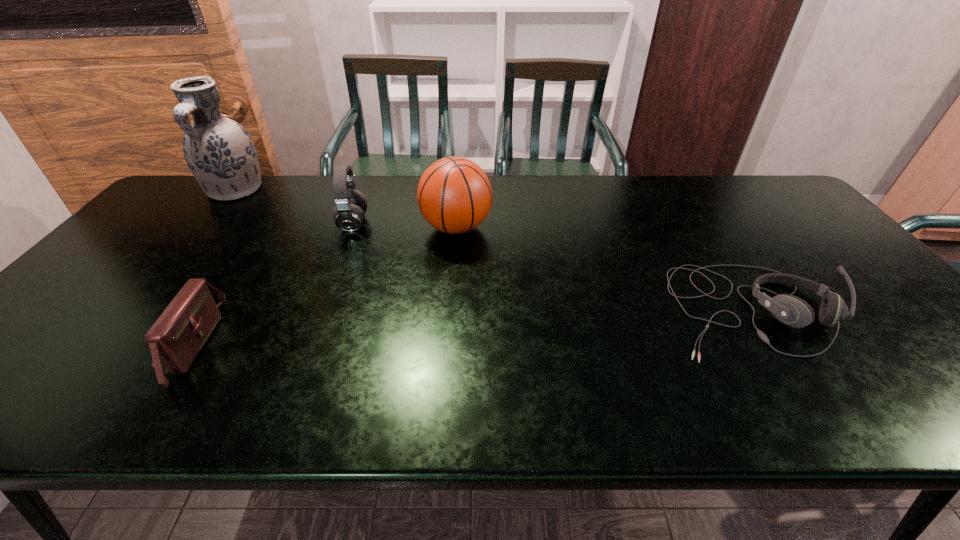
This screenshot has width=960, height=540. What are the coordinates of `vacant point at the far edge` in the screenshot? It's located at (685, 176).

The image size is (960, 540). Identify the location of blank area at the left edge. (x=139, y=227).

Locate an element on the screen. The height and width of the screenshot is (540, 960). vacant position at the right edge of the desktop is located at coordinates (887, 327).

Locate an element on the screen. free space at the near right corner is located at coordinates 914,386.

Locate an element on the screen. vacant space in between the shortest object and the second object from left to right is located at coordinates (470, 327).

Find the location of a particular element. This screenshot has width=960, height=540. unoccupied area between the taller headset and the leftmost object is located at coordinates (294, 207).

At what (x,y) coordinates should I click in order to perform the action: click on vacant space that's between the basketball and the rightmost object. Please return your answer as a coordinate pair (x, y). Looking at the image, I should click on (604, 268).

The height and width of the screenshot is (540, 960). I want to click on free space that is in between the fourth object from right to left and the basketball, so click(x=324, y=286).

Identify the location of empty space that is in between the shorter headset and the vase. (492, 250).

At what (x,y) coordinates should I click in order to perform the action: click on vacant region between the tallest object and the third tallest object. Please return your answer as a coordinate pair (x, y). The height and width of the screenshot is (540, 960). Looking at the image, I should click on (294, 207).